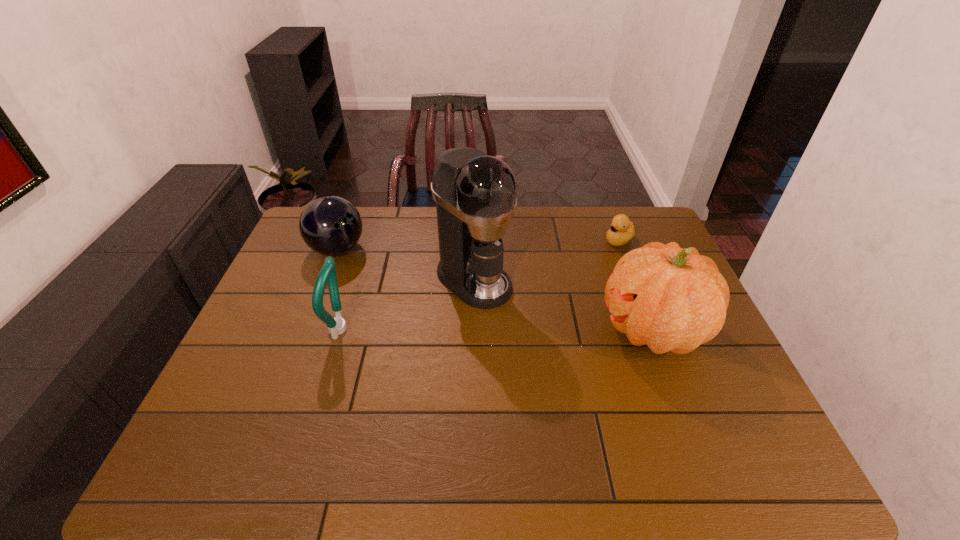
Where is `bowling ball present at the far edge`? This screenshot has width=960, height=540. bowling ball present at the far edge is located at coordinates 330,225.

At what (x,y) coordinates should I click in order to perform the action: click on object situated at the left edge. Please return your answer as a coordinate pair (x, y). Looking at the image, I should click on (330, 225).

Locate an element on the screen. This screenshot has height=540, width=960. pumpkin that is at the right edge is located at coordinates (671, 299).

This screenshot has width=960, height=540. I want to click on duckling present at the right edge, so click(x=622, y=230).

This screenshot has width=960, height=540. Identify the location of object located at the far left corner. (330, 225).

Locate an element on the screen. object located in the far right corner section of the desktop is located at coordinates (622, 230).

The width and height of the screenshot is (960, 540). I want to click on vacant area at the far edge, so pyautogui.click(x=373, y=240).

In the image, there is a desktop. In order to click on vacant space at the near edge in this screenshot , I will do `click(673, 403)`.

The height and width of the screenshot is (540, 960). In the image, there is a desktop. In order to click on vacant space at the left edge in this screenshot , I will do pyautogui.click(x=258, y=325).

Where is `vacant point at the far right corner`? This screenshot has width=960, height=540. vacant point at the far right corner is located at coordinates (616, 206).